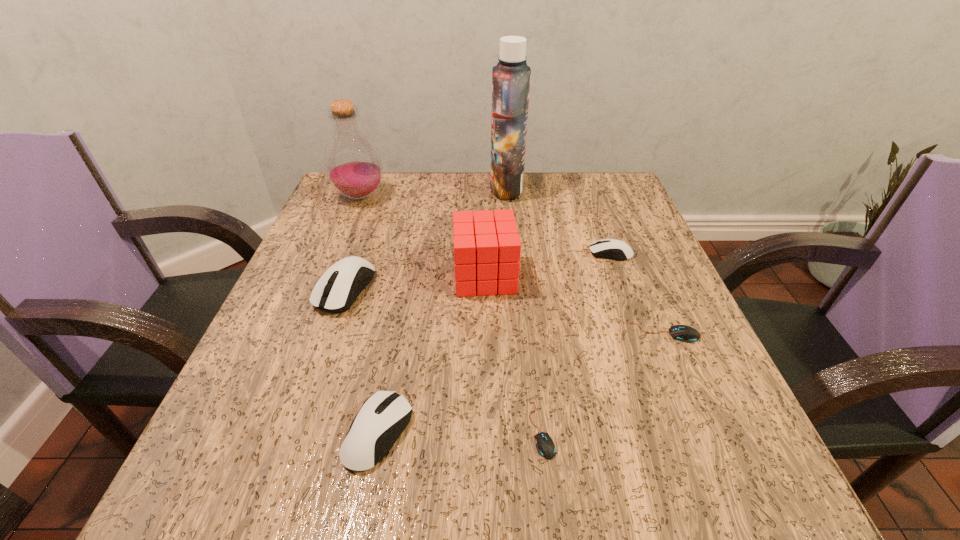
This screenshot has width=960, height=540. Identify the location of the farthest white mouse. (614, 249).

Locate an element on the screen. Image resolution: width=960 pixels, height=540 pixels. the farthest mouse is located at coordinates (614, 249).

The width and height of the screenshot is (960, 540). Find the location of `the third farthest mouse`. the third farthest mouse is located at coordinates (684, 333).

Find the location of a particular element. This screenshot has height=540, width=960. the right black mouse is located at coordinates (684, 333).

Identify the location of the left black mouse. This screenshot has height=540, width=960. (545, 446).

This screenshot has width=960, height=540. I want to click on the shortest object, so click(x=545, y=446).

The height and width of the screenshot is (540, 960). Identify the location of vacant position located 0.140m on the front label of the shampoo. (435, 188).

The width and height of the screenshot is (960, 540). I want to click on vacant region located on the front label of the shampoo, so click(337, 188).

You are a GUI agent. You are given a task and a screenshot of the screen. Output one action in this format:
    pyautogui.click(x=<x>, y=<y>)
    Task: Click on the vacant space situated on the front label of the shampoo
    The width and height of the screenshot is (960, 540).
    Given the screenshot: What is the action you would take?
    pyautogui.click(x=365, y=188)

Where is `vacant space located on the front of the second tallest object`? vacant space located on the front of the second tallest object is located at coordinates (348, 226).